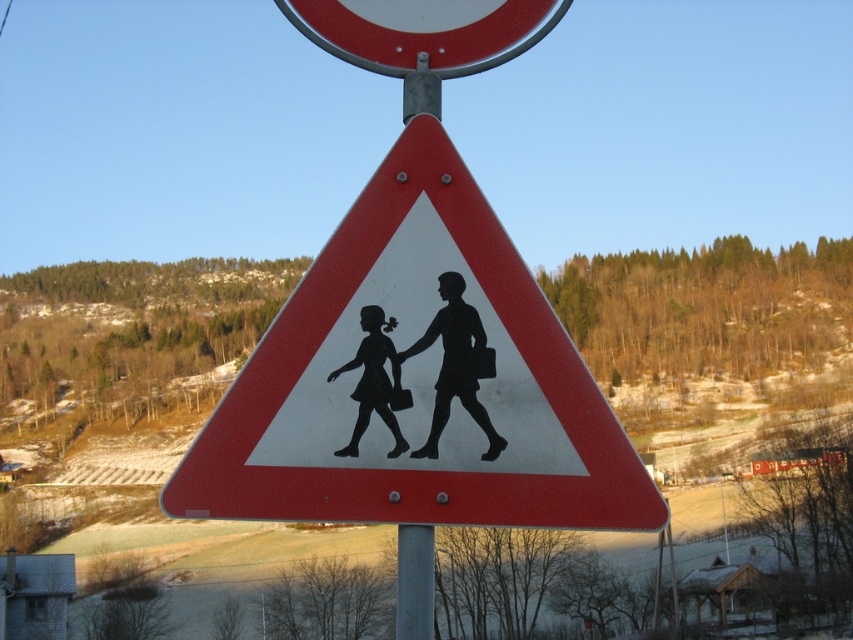
Question: Is white paper triangle at center wider than smooth metal circle at upper center?

Choices:
 (A) no
 (B) yes

Answer: (A)

Question: Which point is farther from the camera taking this photo?

Choices:
 (A) pos(409,44)
 (B) pos(561,369)

Answer: (A)

Question: Which object appears farthest from the camera in this image?

Choices:
 (A) white paper triangle at center
 (B) smooth metal circle at upper center

Answer: (B)

Question: Where is white paper triangle at center located in relation to smooth metal circle at upper center in the image?

Choices:
 (A) left
 (B) right

Answer: (B)

Question: Is the position of white paper triangle at center more distant than that of smooth metal circle at upper center?

Choices:
 (A) yes
 (B) no

Answer: (B)